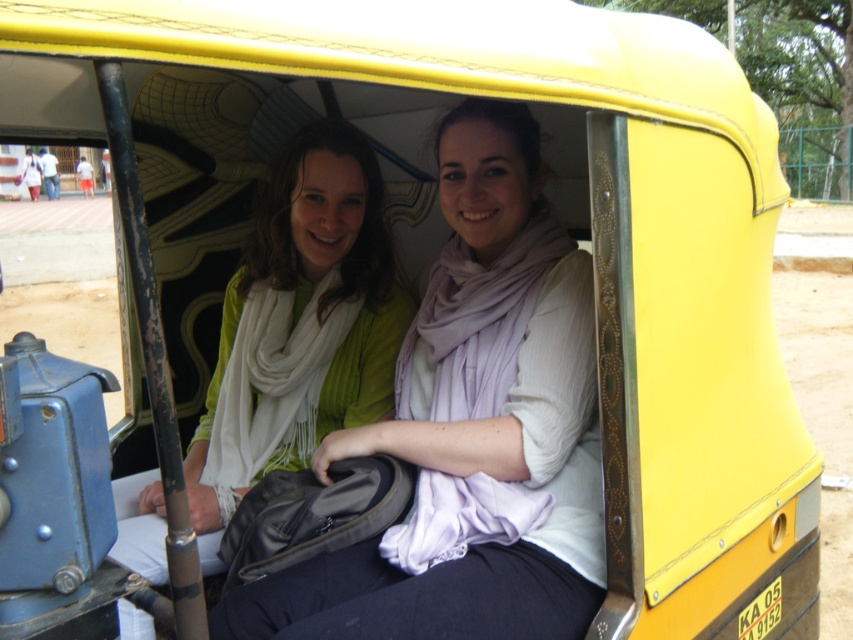
You are a fashion designer observing the two individuals in the yellow auto rickshaw. You need to determine which clothing item from the matte white scarf at center and the matte green sweater at center would require more fabric to produce. Based on the scene, which item would need more material?

The matte white scarf at center requires more fabric since it is larger in size than the matte green sweater at center.

You are a passenger in the yellow auto rickshaw and want to hand a map to the driver. The driver is sitting in front of you. You have two items in your lap, the matte white scarf at center and the matte green sweater at center. Which item is closer to the driver so you can hand it to them first?

The matte white scarf at center is to the right of the matte green sweater at center. Since the driver is in front of you, the item closer to the driver would depend on your seating position. However, based on the description, the matte white scarf at center is positioned to the right of the matte green sweater at center, so if you are seated to the left side, the matte white scarf at center would be closer to the driver. If you are on the right, the matte green sweater at center might be closer. Without a

You are a fashion designer observing the two individuals in the yellow auto rickshaw. You need to determine which of the two items, the matte white scarf at center or the matte green sweater at center, would require less fabric to produce a similar item. Which one would it be?

The matte white scarf at center is thinner than the matte green sweater at center, so the matte white scarf at center would require less fabric to produce a similar item.